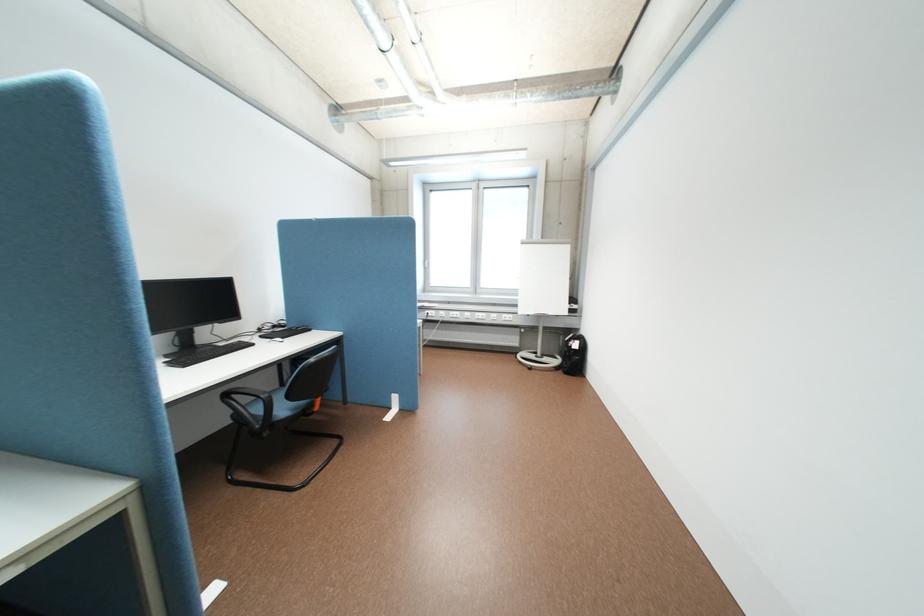
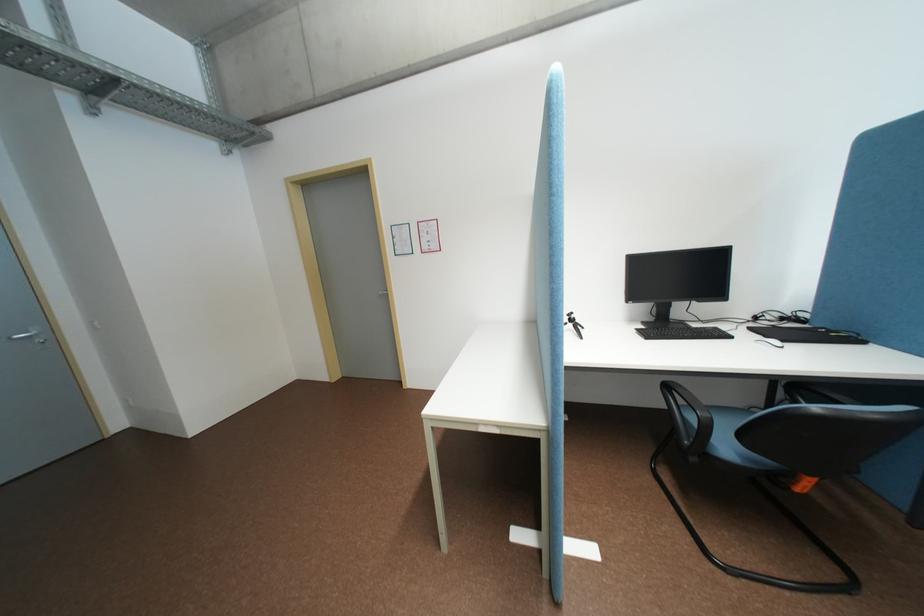
Locate, in the second image, the point that corresponds to [237,395] in the first image.

(677, 386)